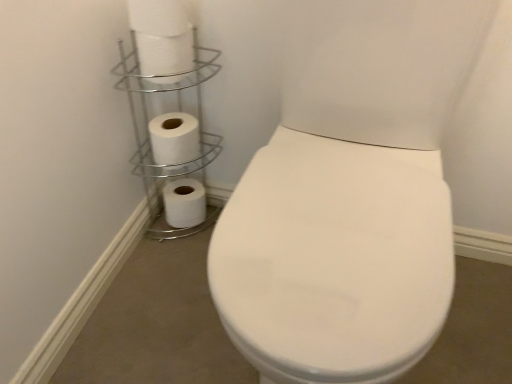
Find the location of a particular element. Image resolution: width=512 pixels, height=384 pixels. unoccupied area in front of silver/metallic toilet paper holder at upper left is located at coordinates (165, 268).